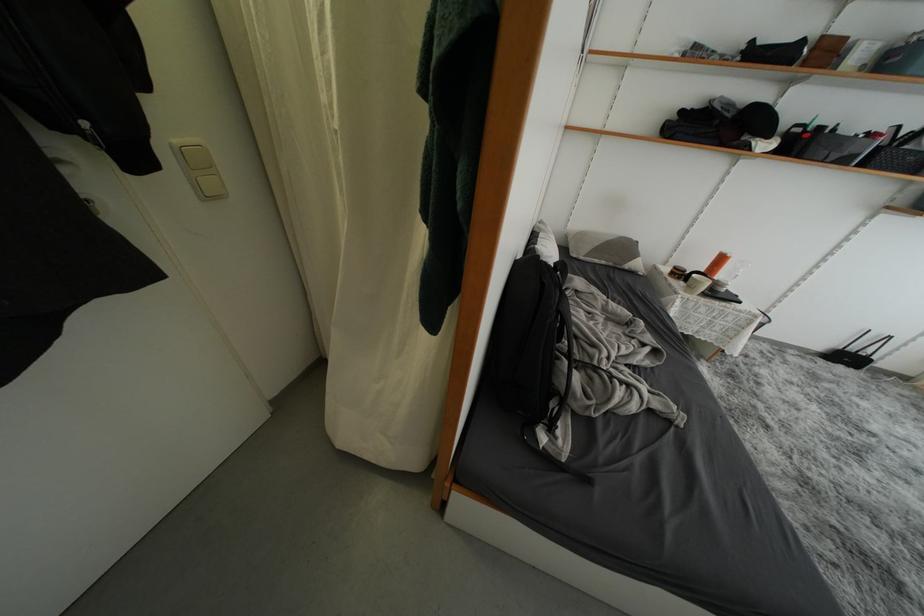
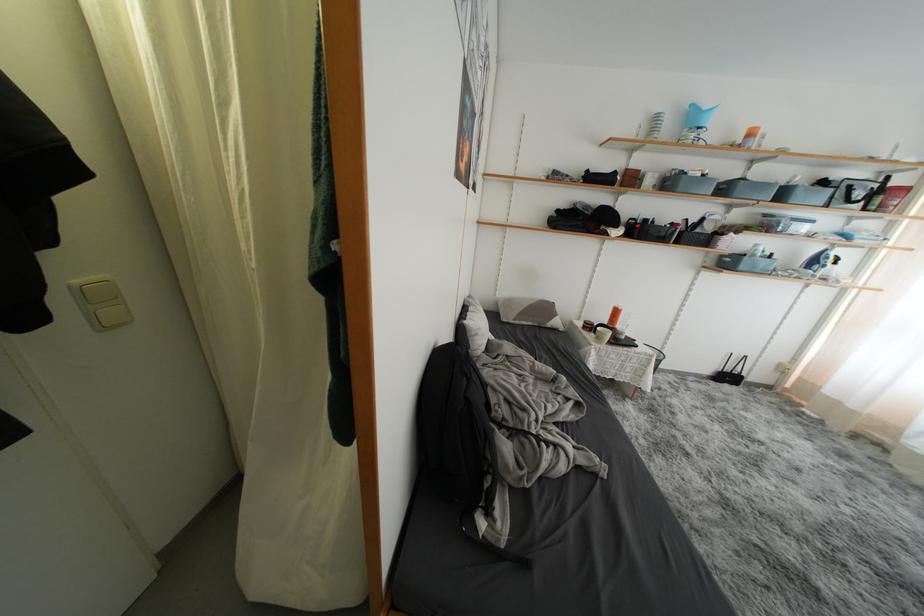
Question: The images are taken continuously from a first-person perspective. In which direction is your viewpoint rotating?

Choices:
 (A) Left
 (B) Right
 (C) Up
 (D) Down

Answer: (C)